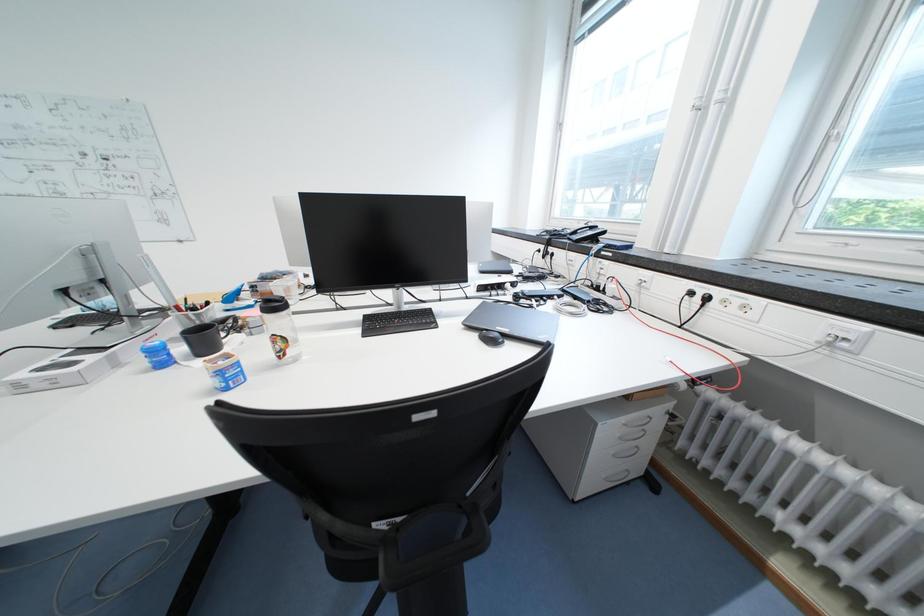
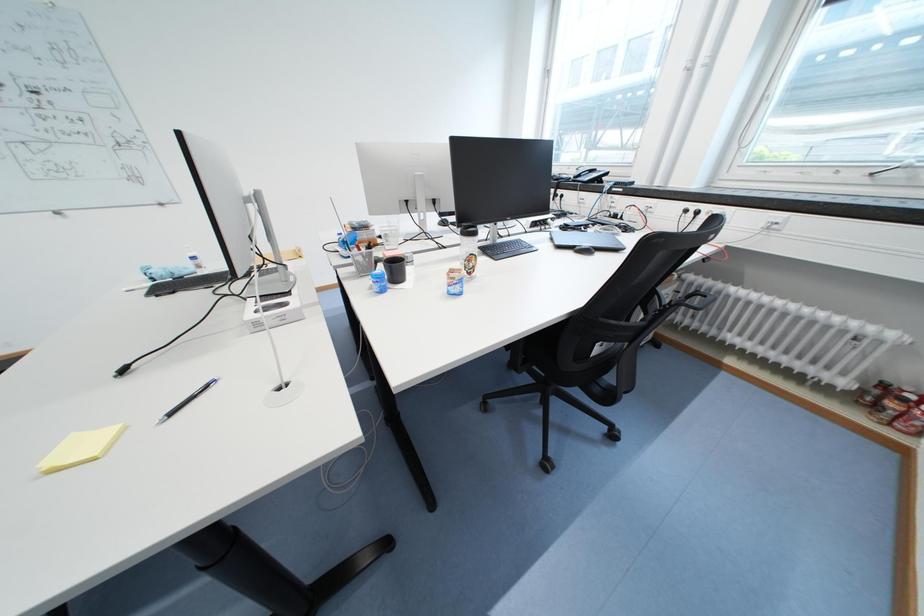
Question: What movement of the cameraman would produce the second image?

Choices:
 (A) Left
 (B) Right
 (C) Forward
 (D) Backward

Answer: (A)